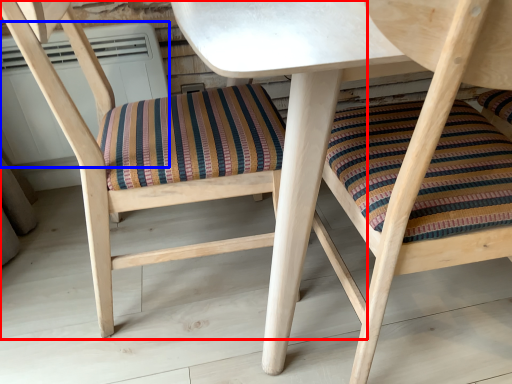
Question: Which object appears closest to the camera in this image, chair (highlighted by a red box) or air conditioner (highlighted by a blue box)?

Choices:
 (A) chair
 (B) air conditioner

Answer: (A)